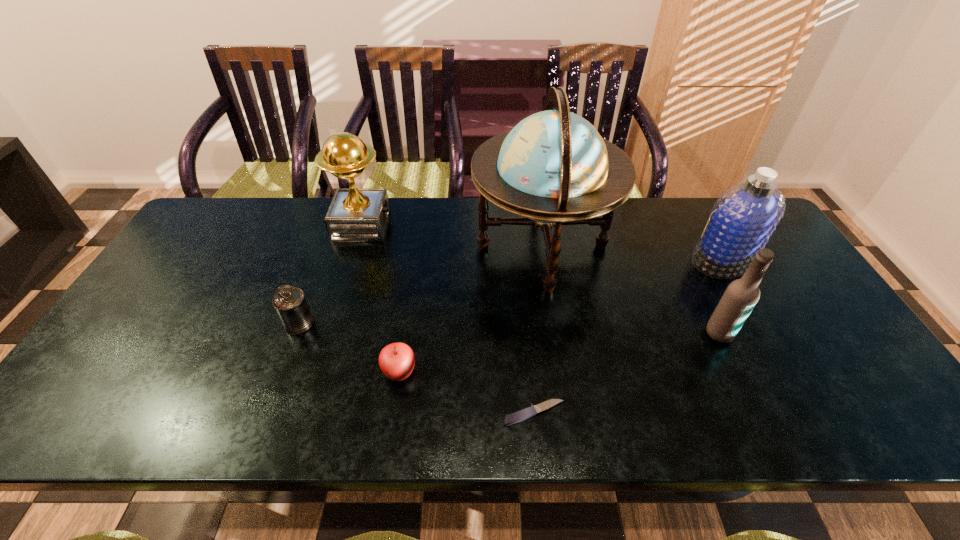
Locate an element on the screen. free space between the award and the second nearest object is located at coordinates (380, 299).

Identify the location of free spot between the nearest object and the can. (417, 368).

Where is `vacant space in between the can and the tallest object`? The image size is (960, 540). vacant space in between the can and the tallest object is located at coordinates (420, 285).

The height and width of the screenshot is (540, 960). Identify the location of unoccupied area between the beer bottle and the shortest object. coord(627,373).

In order to click on free space that is in between the award and the third shortest object in this screenshot , I will do `click(330, 275)`.

Locate an element on the screen. The image size is (960, 540). vacant area between the third object from left to right and the beer bottle is located at coordinates tap(560, 352).

Where is `free area in between the fifth tallest object and the beer bottle`? The image size is (960, 540). free area in between the fifth tallest object and the beer bottle is located at coordinates (510, 328).

Locate an element on the screen. free spot between the sixth farthest object and the award is located at coordinates (380, 299).

The height and width of the screenshot is (540, 960). I want to click on free space between the nearest object and the sixth farthest object, so click(467, 393).

Locate which object ranks third in proximity to the award. Please provide its 2D coordinates. Your answer should be formatted as a tuple, i.e. [(x, y)], where the tuple contains the x and y coordinates of a point satisfying the conditions above.

[(396, 360)]